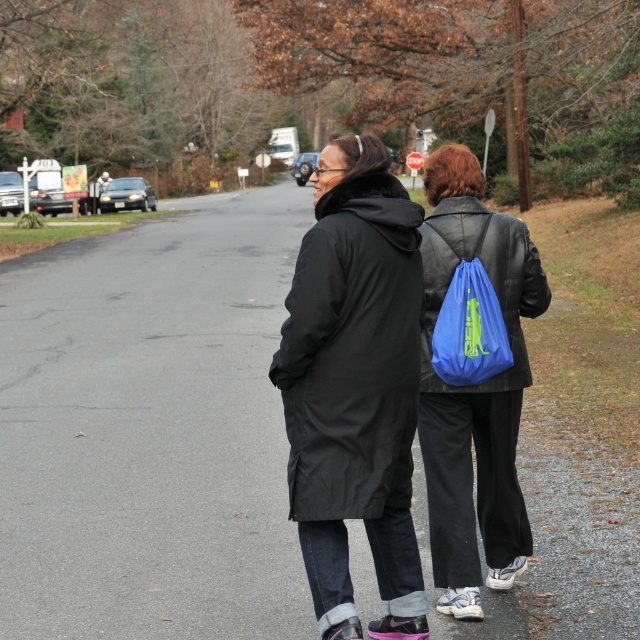
Who is more forward, (x=324, y=310) or (x=486, y=336)?

Point (x=324, y=310) is more forward.

Between matte black jacket at center and blue fabric backpack at center-right, which one has more height?

matte black jacket at center is taller.

Image resolution: width=640 pixels, height=640 pixels. What do you see at coordinates (355, 385) in the screenshot?
I see `matte black jacket at center` at bounding box center [355, 385].

This screenshot has height=640, width=640. Find the location of `matte black jacket at center`. matte black jacket at center is located at coordinates (355, 385).

Who is lower down, blue fabric backpack at right or blue fabric backpack at center-right?

Positioned lower is blue fabric backpack at right.

Between blue fabric backpack at right and blue fabric backpack at center-right, which one is positioned higher?

Positioned higher is blue fabric backpack at center-right.

Identify the location of blue fabric backpack at right. The image size is (640, 640). (472, 481).

Between matte black jacket at center and blue fabric backpack at right, which one has more height?

blue fabric backpack at right is taller.

I want to click on matte black jacket at center, so click(355, 385).

Does point (388, 449) come behind point (424, 432)?

No, it is in front of (424, 432).

Find the location of a particular element. This screenshot has height=640, width=640. matte black jacket at center is located at coordinates (355, 385).